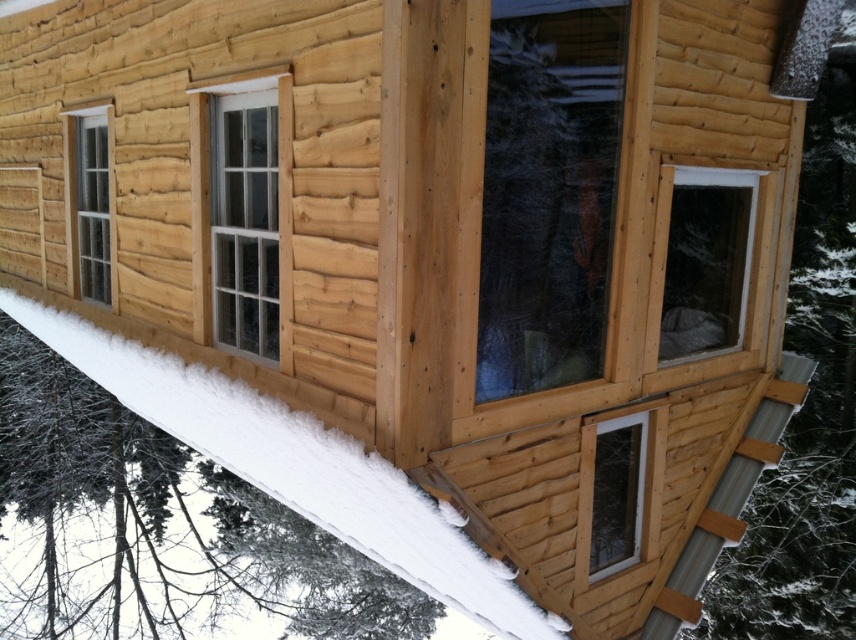
Question: Considering the real-world distances, which object is farthest from the transparent glass window at center?

Choices:
 (A) clear glass window at center
 (B) clear glass window at center right

Answer: (A)

Question: Which object is positioned closest to the white plastic window at lower right?

Choices:
 (A) clear glass window at center right
 (B) clear glass window at center
 (C) transparent glass window at center
 (D) clear glass window at left

Answer: (A)

Question: Which point appears farthest from the camera in this image?

Choices:
 (A) (x=91, y=209)
 (B) (x=627, y=436)
 (C) (x=489, y=124)

Answer: (A)

Question: Is the position of clear glass window at center more distant than that of clear glass window at center right?

Choices:
 (A) yes
 (B) no

Answer: (B)

Question: Is clear glass window at center closer to the viewer compared to clear glass window at center right?

Choices:
 (A) no
 (B) yes

Answer: (B)

Question: Is transparent glass window at center in front of clear glass window at left?

Choices:
 (A) yes
 (B) no

Answer: (A)